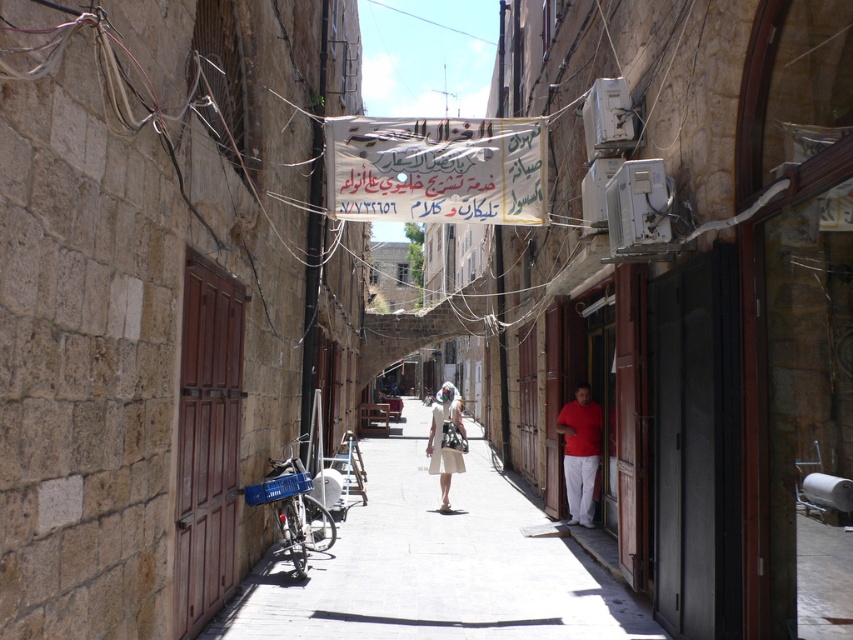
You are a delivery person trying to navigate through the narrow alleyway. You see a matte red shirt at right and a white cotton dress at center. Which item is positioned higher up in the alleyway?

The matte red shirt at right is above the white cotton dress at center, so the matte red shirt at right is positioned higher up in the alleyway.